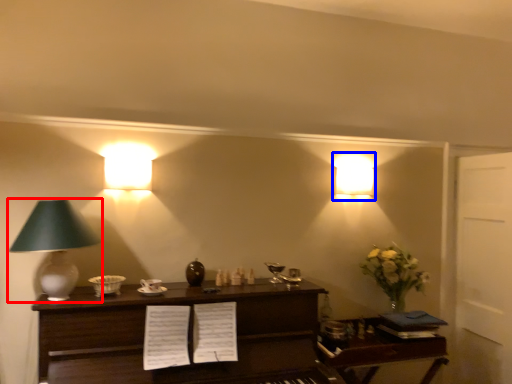
Question: Which point is further to the camera, lamp (highlighted by a red box) or lamp (highlighted by a blue box)?

Choices:
 (A) lamp
 (B) lamp

Answer: (B)